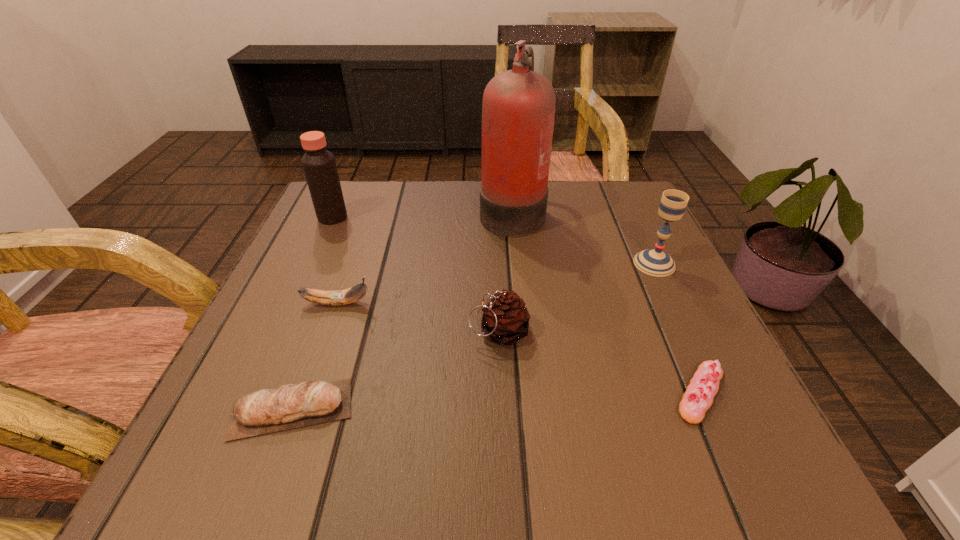
What are the coordinates of `object that is at the far left corner` in the screenshot? It's located at (319, 165).

The height and width of the screenshot is (540, 960). What are the coordinates of `object situated at the near left corner` in the screenshot? It's located at (290, 406).

At what (x,y) coordinates should I click in order to perform the action: click on object positioned at the near right corner. Please return your answer as a coordinate pair (x, y). Looking at the image, I should click on (698, 398).

This screenshot has width=960, height=540. I want to click on free space at the far edge of the desktop, so click(412, 187).

Identify the location of vacant space at the near edge of the desktop. (642, 443).

In the image, there is a desktop. Where is `vacant space at the left edge`? This screenshot has height=540, width=960. vacant space at the left edge is located at coordinates (335, 261).

Where is `free region at the right edge`? The height and width of the screenshot is (540, 960). free region at the right edge is located at coordinates (604, 268).

The height and width of the screenshot is (540, 960). I want to click on free point at the far left corner, so click(371, 200).

Where is `free point at the near left corner`? This screenshot has height=540, width=960. free point at the near left corner is located at coordinates (288, 431).

Identify the location of free space at the far right corner. (632, 195).